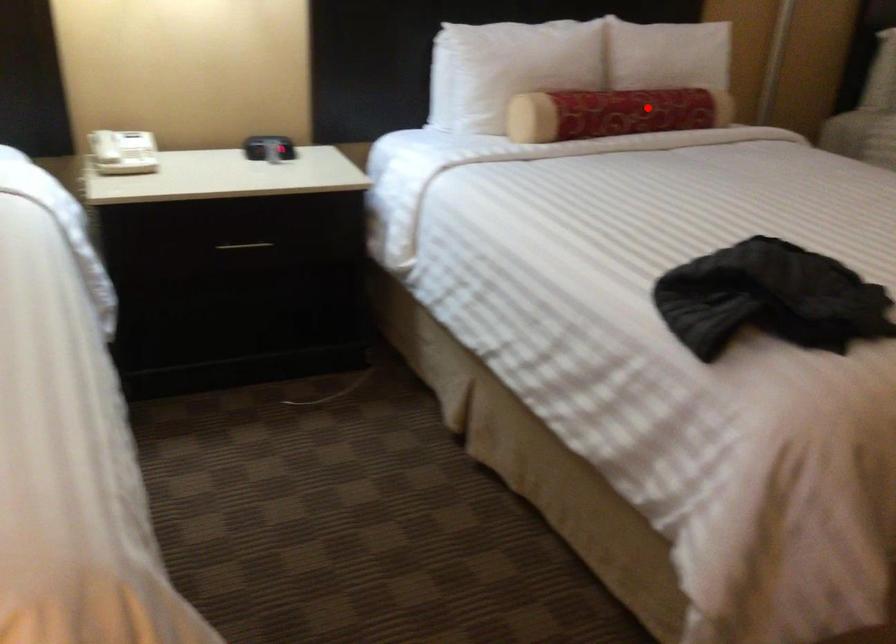
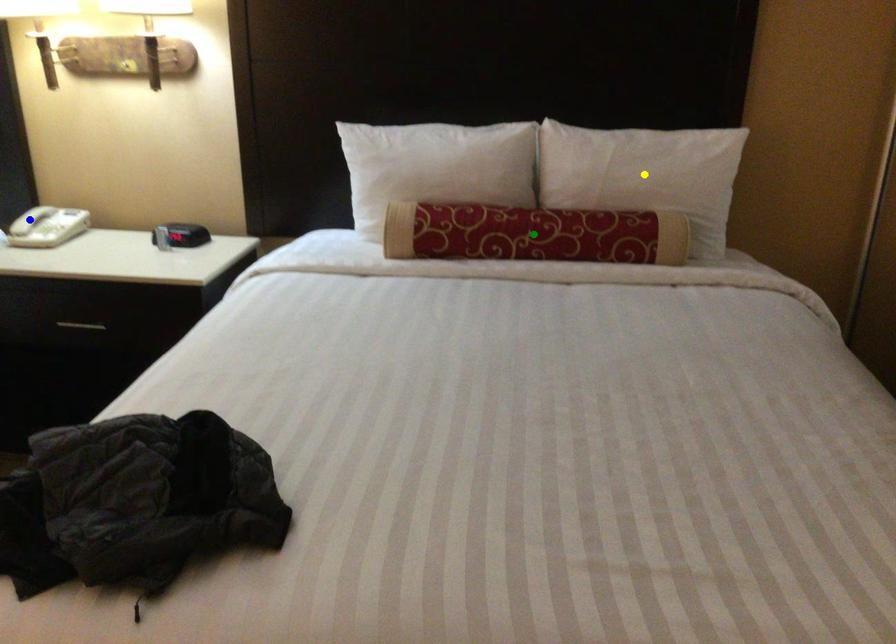
Question: I am providing you with two images of the same scene from different viewpoints. A red point is marked on the first image. You are given multiple points on the second image. Which point in image 2 represents the same 3d spot as the red point in image 1?

Choices:
 (A) blue point
 (B) green point
 (C) yellow point

Answer: (B)